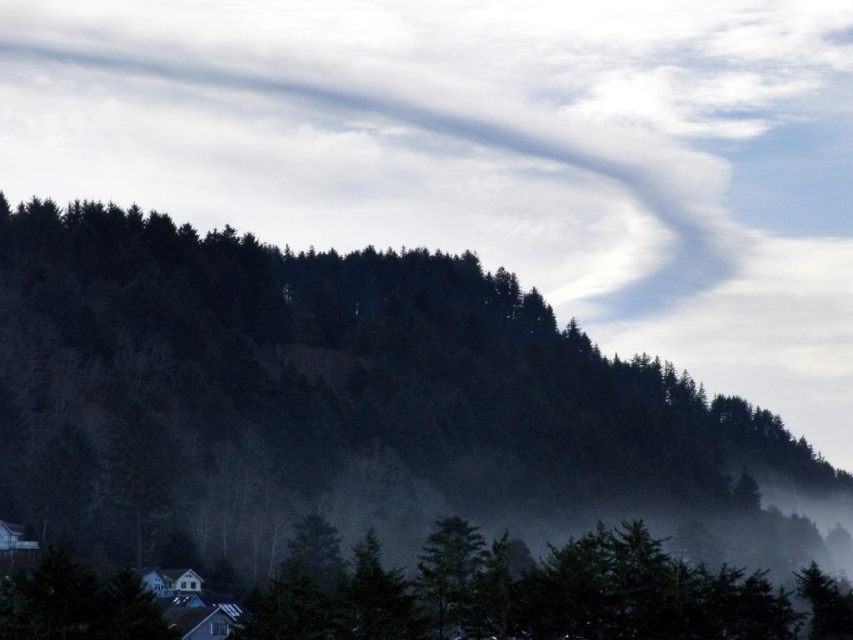
Question: Can you confirm if green matte trees at center is bigger than green matte tree at lower center?

Choices:
 (A) no
 (B) yes

Answer: (B)

Question: Which point is farther to the camera?

Choices:
 (A) (422, 577)
 (B) (65, 312)

Answer: (B)

Question: Does green matte trees at center have a larger size compared to green matte tree at lower center?

Choices:
 (A) yes
 (B) no

Answer: (A)

Question: Can you confirm if green matte trees at center is positioned above green matte tree at lower center?

Choices:
 (A) no
 (B) yes

Answer: (B)

Question: Which point appears farthest from the camera in this image?

Choices:
 (A) (451, 316)
 (B) (418, 560)

Answer: (A)